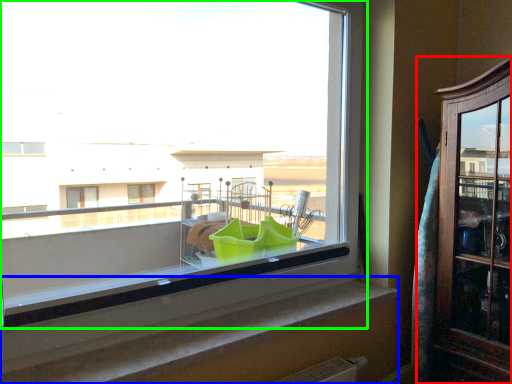
Question: Which object is the farthest from dresser (highlighted by a red box)? Choose among these: window sill (highlighted by a blue box) or window (highlighted by a green box).

Choices:
 (A) window sill
 (B) window

Answer: (B)